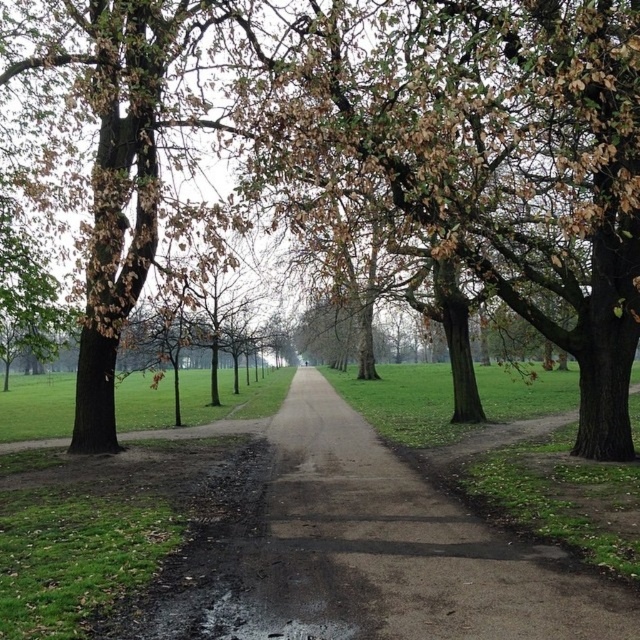
You are standing on the dull brown dirt path at center and want to walk towards the green leafy tree at center. Is the tree in front of or behind you?

The green leafy tree at center is further to the viewer than the dull brown dirt path at center, so the tree is in front of you.

You are standing at the point point (486, 154) in the park. Which direction should you walk to reach the paved pathway that stretches into the distance?

The green leafy tree at center is represented by point (486, 154). The paved pathway is in the center of the park, so you should walk towards the center to reach it.